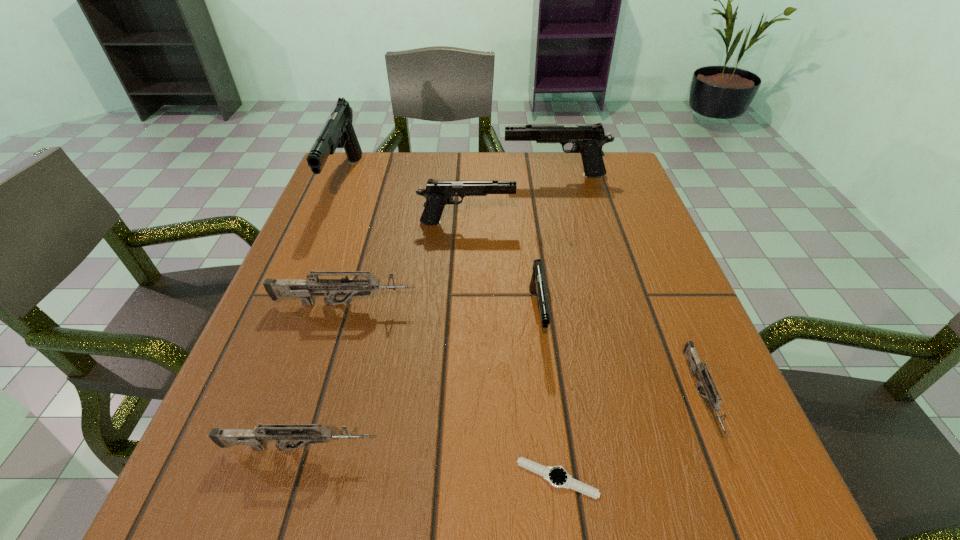
The height and width of the screenshot is (540, 960). What are the coordinates of `the seventh tallest object` in the screenshot? It's located at (x=714, y=401).

This screenshot has height=540, width=960. What are the coordinates of `the rightmost gun` in the screenshot? It's located at (714, 401).

This screenshot has height=540, width=960. In order to click on the shortest object in this screenshot , I will do `click(557, 476)`.

Where is `the nearest object`? The height and width of the screenshot is (540, 960). the nearest object is located at coordinates (557, 476).

Locate an element on the screen. The width and height of the screenshot is (960, 540). vacant region located at the aiming end of the biggest black gun is located at coordinates (281, 340).

The height and width of the screenshot is (540, 960). Identify the location of vacant space located 0.060m at the aiming end of the second tallest gun. (480, 176).

Identify the location of vacant area situated 0.390m at the aiming end of the second tallest gun. This screenshot has width=960, height=540. (354, 176).

At what (x,y) coordinates should I click in order to perform the action: click on free point located at the aiming end of the second tallest gun. Please return your answer as a coordinate pair (x, y). Looking at the image, I should click on click(x=423, y=176).

The width and height of the screenshot is (960, 540). I want to click on vacant region located at the aiming end of the second nearest black gun, so click(544, 223).

Identify the location of vacant space situated 0.190m at the aiming end of the nearest black gun. The image size is (960, 540). (555, 461).